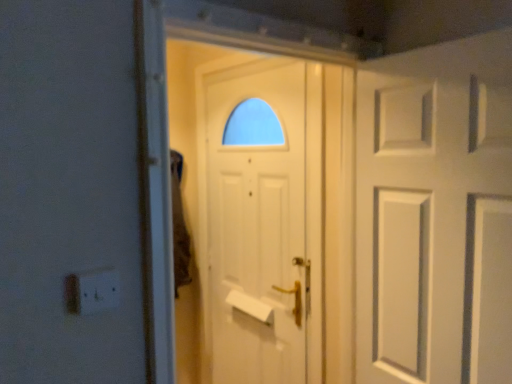
Question: Considering the positions of point (96, 311) and point (252, 147), is point (96, 311) closer or farther from the camera than point (252, 147)?

Choices:
 (A) closer
 (B) farther

Answer: (A)

Question: Is white plastic electric outlet at lower left bigger or smaller than white matte door at center, placed as the second door when sorted from right to left?

Choices:
 (A) small
 (B) big

Answer: (A)

Question: Which object is positioned farthest from the white plastic electric outlet at lower left?

Choices:
 (A) white matte door at center, which is the 1th door in back-to-front order
 (B) white matte door at right, the second door from the back

Answer: (A)

Question: Which is nearer to the white matte door at right, the 1th door positioned from the right?

Choices:
 (A) white plastic electric outlet at lower left
 (B) white matte door at center, which is the 1th door from left to right

Answer: (B)